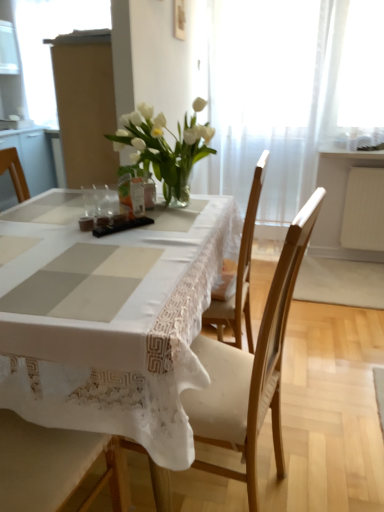
Question: Which is correct: clear glass vase at center is inside matte cardboard box at upper left, or outside of it?

Choices:
 (A) inside
 (B) outside

Answer: (B)

Question: From a real-world perspective, is clear glass vase at center above or below matte cardboard box at upper left?

Choices:
 (A) above
 (B) below

Answer: (B)

Question: Estimate the real-world distances between objects in this image. Which object is closer to the wooden chair at center?

Choices:
 (A) white lace tablecloth at center
 (B) white sheer curtain at upper center
 (C) matte cardboard box at upper left
 (D) clear glass vase at center
 (E) white glass vase at center

Answer: (A)

Question: Which is farther from the wooden chair at center?

Choices:
 (A) clear glass vase at center
 (B) matte cardboard box at upper left
 (C) white lace tablecloth at center
 (D) white glass vase at center
 (E) white sheer curtain at upper center

Answer: (B)